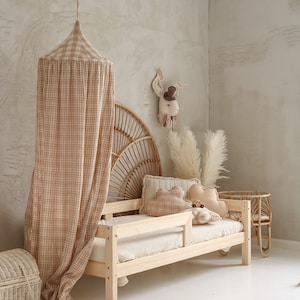
Locate an element on the screen. The width and height of the screenshot is (300, 300). white floor is located at coordinates (251, 286).